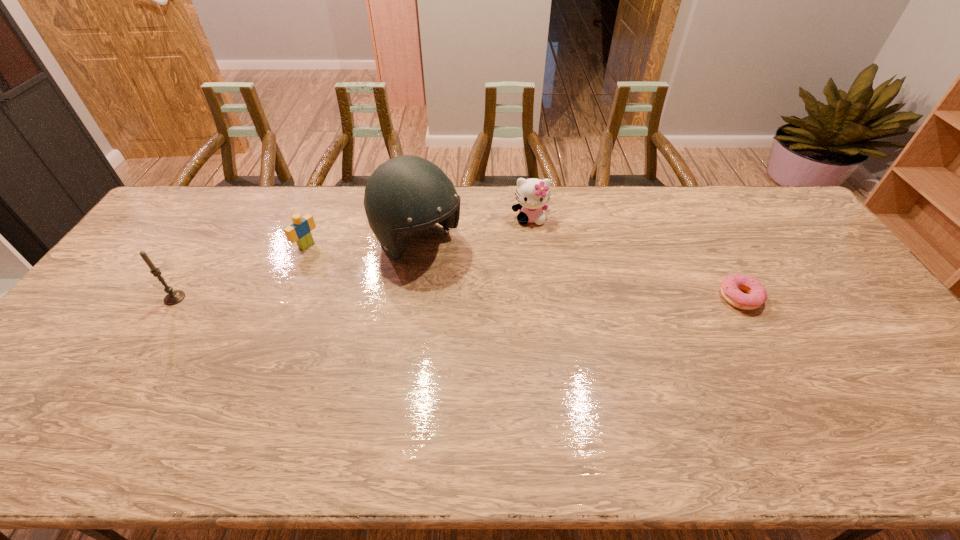
You are a GUI agent. You are given a task and a screenshot of the screen. Output one action in this format:
    pyautogui.click(x=<x>, y=<y>)
    Task: Click on the vacant space located 0.370m on the left of the shortest object
    The image size is (960, 540).
    Given the screenshot: What is the action you would take?
    pyautogui.click(x=589, y=297)

Locate an element on the screen. Image resolution: width=960 pixels, height=540 pixels. vacant space located on the face of the fourth tallest object is located at coordinates (327, 258).

Where is `vacant area situated 0.250m on the face of the fourth tallest object`? This screenshot has height=540, width=960. vacant area situated 0.250m on the face of the fourth tallest object is located at coordinates (372, 283).

The image size is (960, 540). Identify the location of vacant region located 0.140m on the face of the fourth tallest object. (346, 268).

The image size is (960, 540). What are the coordinates of `free space located 0.160m at the face opening of the third object from right to left` in the screenshot? It's located at (481, 295).

Where is `free point located 0.090m at the face opening of the third object from right to left`? free point located 0.090m at the face opening of the third object from right to left is located at coordinates (465, 282).

Locate an element on the screen. vacant space situated 0.310m at the face opening of the third object from right to left is located at coordinates (518, 326).

Identify the location of vacant point located on the front-facing side of the kitten. (535, 307).

Image resolution: width=960 pixels, height=540 pixels. Find the location of `free space located 0.230m on the front-facing side of the kitten`. free space located 0.230m on the front-facing side of the kitten is located at coordinates (533, 276).

Locate an element on the screen. This screenshot has height=540, width=960. free space located on the front-facing side of the kitten is located at coordinates (532, 252).